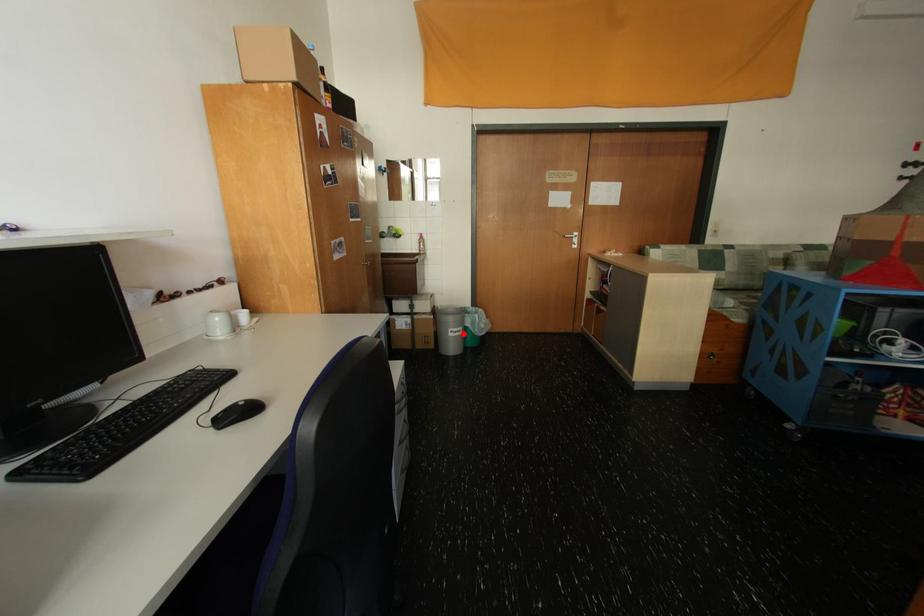
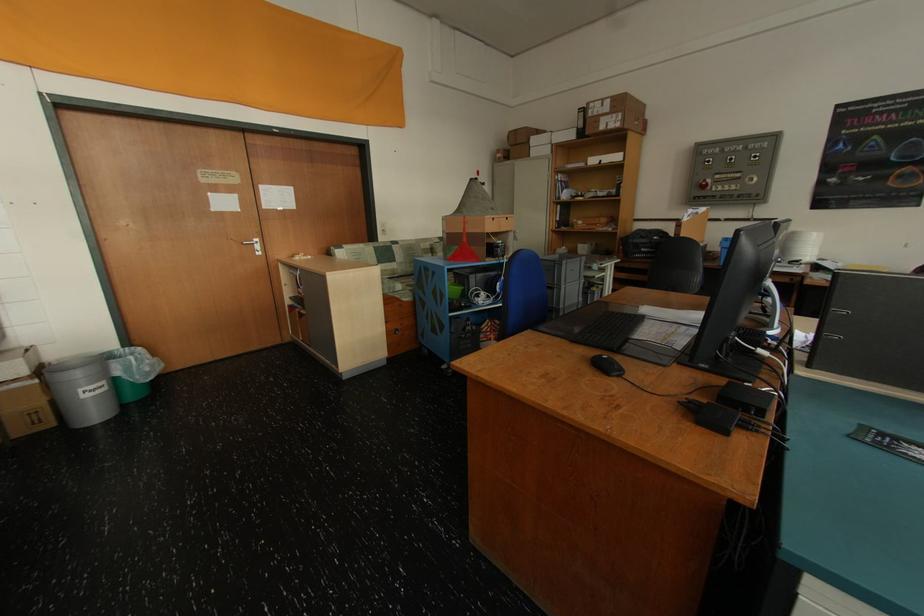
Where in the second image is the point corresponding to the highlighted location from the first image?

(101, 392)